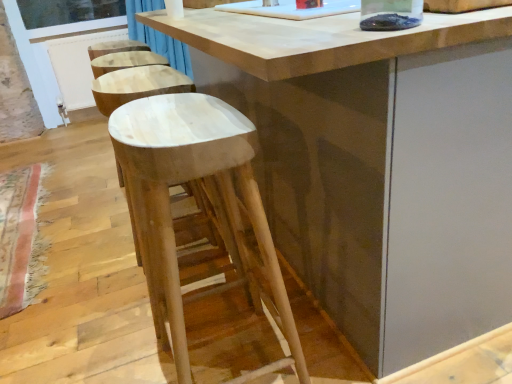
Where is `vacant space to the left of natural wood stool at center`? Image resolution: width=512 pixels, height=384 pixels. vacant space to the left of natural wood stool at center is located at coordinates (116, 348).